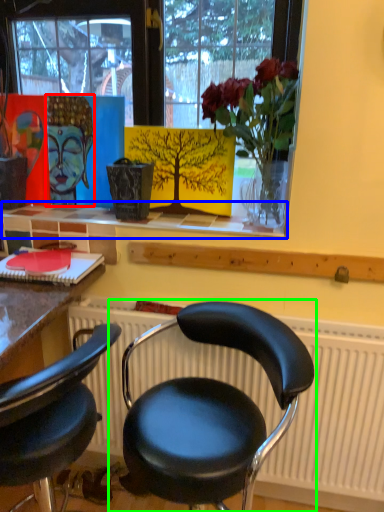
Question: Considering the real-world distances, which object is farthest from art (highlighted by a red box)? window sill (highlighted by a blue box) or chair (highlighted by a green box)?

Choices:
 (A) window sill
 (B) chair

Answer: (B)